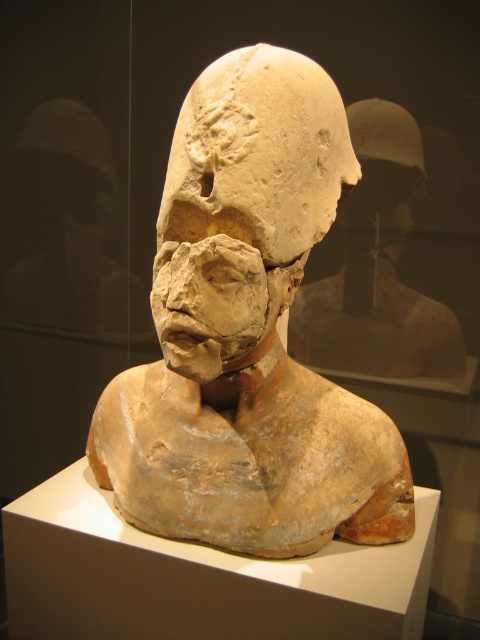
Is earthenware sculpture at center thinner than matte clay head at center?

In fact, earthenware sculpture at center might be wider than matte clay head at center.

Which is in front, point (196, 268) or point (269, 81)?

Point (196, 268) is in front.

Locate an element on the screen. earthenware sculpture at center is located at coordinates (248, 336).

Is matte clay head at center closer to the viewer compared to matte clay bust at center?

Yes.

Does matte clay head at center have a greater width compared to matte clay bust at center?

Correct, the width of matte clay head at center exceeds that of matte clay bust at center.

Measure the distance between point (x=312, y=240) and camera.

1.68 meters

Where is `matte clay head at center`? This screenshot has width=480, height=640. matte clay head at center is located at coordinates (244, 205).

Does earthenware sculpture at center have a smaller size compared to matte clay bust at center?

Actually, earthenware sculpture at center might be larger than matte clay bust at center.

Between earthenware sculpture at center and matte clay bust at center, which one has more height?

Standing taller between the two is earthenware sculpture at center.

Who is more forward, (245, 316) or (404, 188)?

Point (245, 316)

Identify the location of earthenware sculpture at center. The height and width of the screenshot is (640, 480). (248, 336).